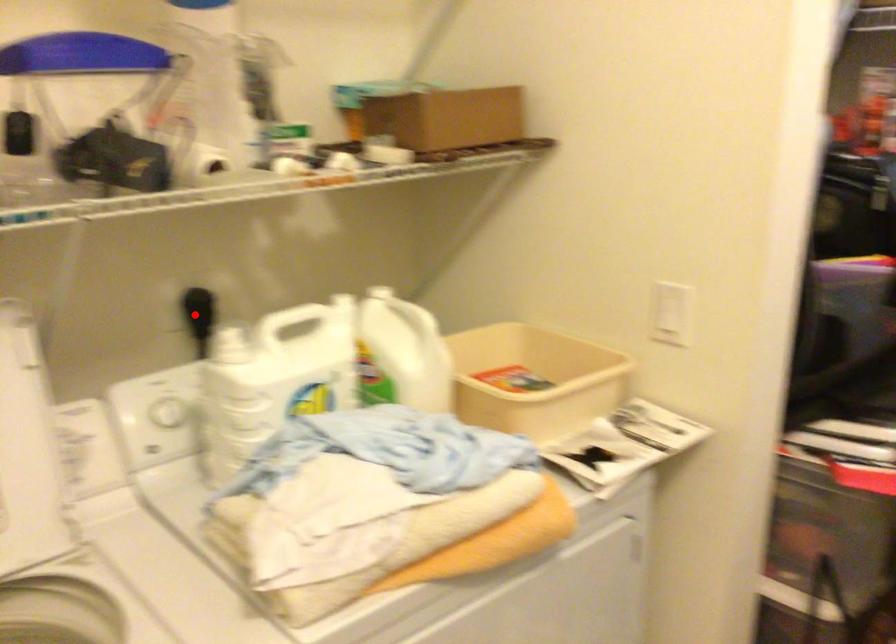
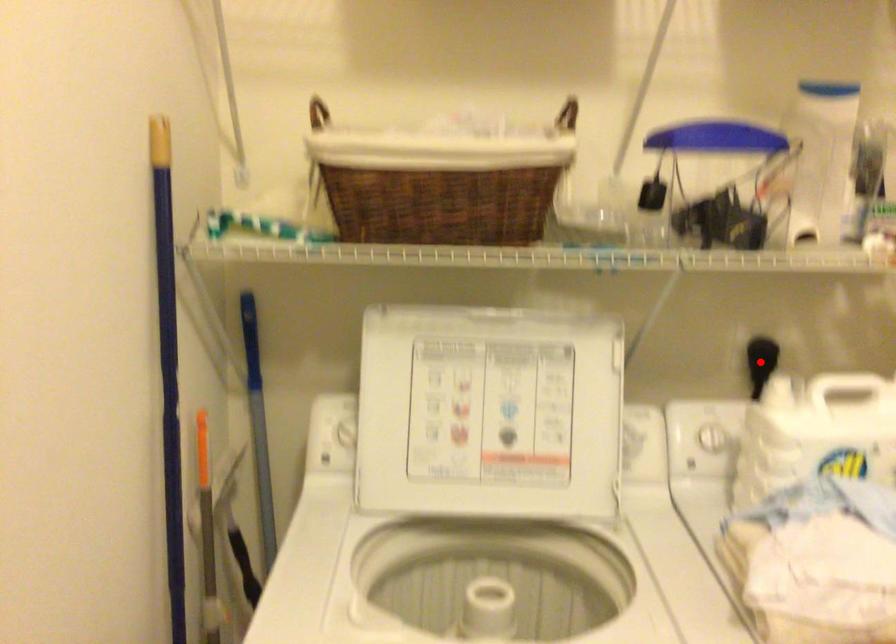
I am providing you with two images of the same scene from different viewpoints. A red point is marked on the first image and another point is marked on the second image. Does the point marked in image1 correspond to the same location as the one in image2?

Yes